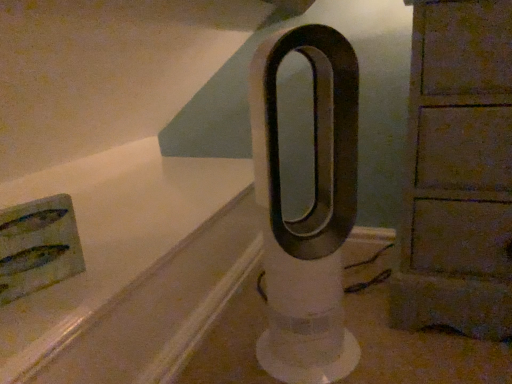
What do you see at coordinates (458, 173) in the screenshot? I see `wooden cabinet at right` at bounding box center [458, 173].

Measure the distance between wooden cabinet at right and camera.

wooden cabinet at right and camera are 26.40 inches apart.

You are a GUI agent. You are given a task and a screenshot of the screen. Output one action in this format:
    pyautogui.click(x=<x>, y=<y>)
    Task: Click on the wooden cabinet at right
    
    Given the screenshot: What is the action you would take?
    pyautogui.click(x=458, y=173)

In order to face white plastic fan at center, should I rotate leftwards or rightwards?

Rotate your view right by about 6.672°.

At what (x,y) coordinates should I click in order to perform the action: click on white plastic fan at center. Please return your answer as a coordinate pair (x, y). This screenshot has height=384, width=512. Looking at the image, I should click on (308, 212).

What do you see at coordinates (308, 212) in the screenshot?
I see `white plastic fan at center` at bounding box center [308, 212].

You are a GUI agent. You are given a task and a screenshot of the screen. Output one action in this format:
    pyautogui.click(x=<x>, y=<y>)
    Task: Click on the wooden cabinet at right
    This screenshot has width=512, height=384.
    Given the screenshot: What is the action you would take?
    pyautogui.click(x=458, y=173)

Which is more to the right, white plastic fan at center or wooden cabinet at right?

From the viewer's perspective, wooden cabinet at right appears more on the right side.

Which is behind, white plastic fan at center or wooden cabinet at right?

Positioned behind is wooden cabinet at right.

Which is nearer, (355, 354) or (452, 130)?

Point (355, 354) is farther from the camera than point (452, 130).

From the image's perspective, who appears lower, white plastic fan at center or wooden cabinet at right?

white plastic fan at center appears lower in the image.

From a real-world perspective, which is physically above, white plastic fan at center or wooden cabinet at right?

From a 3D spatial view, wooden cabinet at right is above.

Is white plastic fan at center thinner than wooden cabinet at right?

Answer: Correct, the width of white plastic fan at center is less than that of wooden cabinet at right.

Is white plastic fan at center shorter than wooden cabinet at right?

Indeed, white plastic fan at center has a lesser height compared to wooden cabinet at right.

Consider the image. Is white plastic fan at center smaller than wooden cabinet at right?

Yes.

Is white plastic fan at center outside of wooden cabinet at right?

Absolutely, white plastic fan at center is external to wooden cabinet at right.

Are white plastic fan at center and wooden cabinet at right beside each other?

white plastic fan at center is not next to wooden cabinet at right, and they're not touching.

Does white plastic fan at center turn towards wooden cabinet at right?

No.

Where is `furniture above the white plastic fan at center (from the image's perspective)`? Image resolution: width=512 pixels, height=384 pixels. furniture above the white plastic fan at center (from the image's perspective) is located at coordinates (458, 173).

In the scene shown: Considering the positions of objects wooden cabinet at right and white plastic fan at center in the image provided, who is more to the left, wooden cabinet at right or white plastic fan at center?

Positioned to the left is white plastic fan at center.

Does wooden cabinet at right come in front of white plastic fan at center?

No, wooden cabinet at right is further to the viewer.

Which point is more distant from viewer, [480,199] or [332,322]?

The point [332,322] is farther from the camera.

From the image's perspective, between wooden cabinet at right and white plastic fan at center, who is located below?

From the image's view, white plastic fan at center is below.

From a real-world perspective, is wooden cabinet at right on white plastic fan at center?

Yes, from a real-world perspective, wooden cabinet at right is above white plastic fan at center.

Which object is wider, wooden cabinet at right or white plastic fan at center?

wooden cabinet at right.

Does wooden cabinet at right have a lesser height compared to white plastic fan at center?

No.

Based on the photo, who is bigger, wooden cabinet at right or white plastic fan at center?

wooden cabinet at right is bigger.

Is wooden cabinet at right spatially inside white plastic fan at center, or outside of it?

The correct answer is: outside.

Is wooden cabinet at right far from white plastic fan at center?

No, wooden cabinet at right is in close proximity to white plastic fan at center.

Is wooden cabinet at right turned away from white plastic fan at center?

No.

How different are the orientations of wooden cabinet at right and white plastic fan at center in degrees?

There is a 39.1-degree angle between the facing directions of wooden cabinet at right and white plastic fan at center.

How distant is wooden cabinet at right from white plastic fan at center?

The distance of wooden cabinet at right from white plastic fan at center is 7.85 inches.

Locate an element on the screen. This screenshot has width=512, height=384. furniture above the white plastic fan at center (from the image's perspective) is located at coordinates (458, 173).

What are the coordinates of `furniture located above the white plastic fan at center (from a real-world perspective)` in the screenshot? It's located at (458, 173).

Locate an element on the screen. Image resolution: width=512 pixels, height=384 pixels. pillar directly beneath the wooden cabinet at right (from a real-world perspective) is located at coordinates (308, 212).